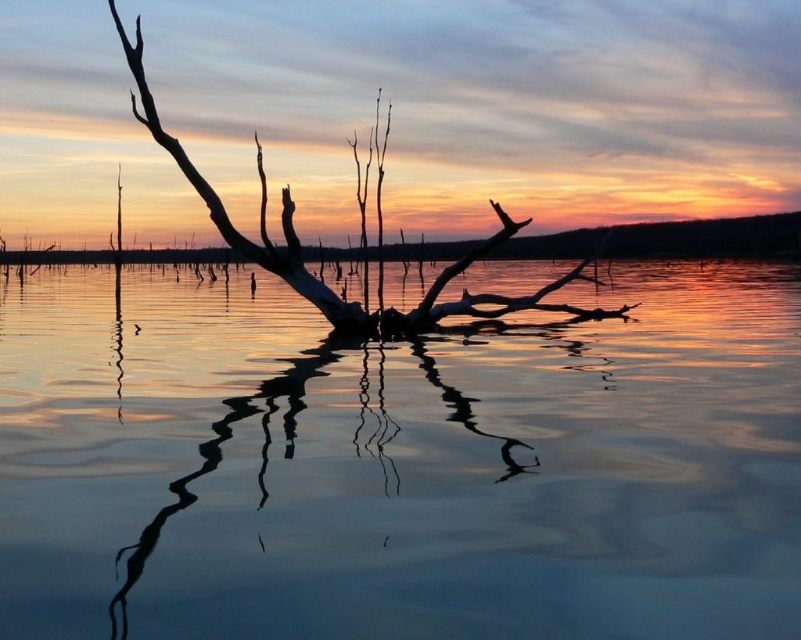
You are standing at the point with coordinates point (270,406) and want to move to the point with coordinates point (288,218). Given that there is a submerged dead tree between you and your destination, can you reach the destination without passing through the tree?

Point (288,218) is behind point (270,406), so yes, you can reach the destination without passing through the tree because the destination is behind the submerged dead tree which is between you and the tree.

You are an artist trying to paint the sunset scene. You notice the transparent water at center and the silvery wood branch at center. Which object appears taller in the image?

The transparent water at center is taller than the silvery wood branch at center according to the description.